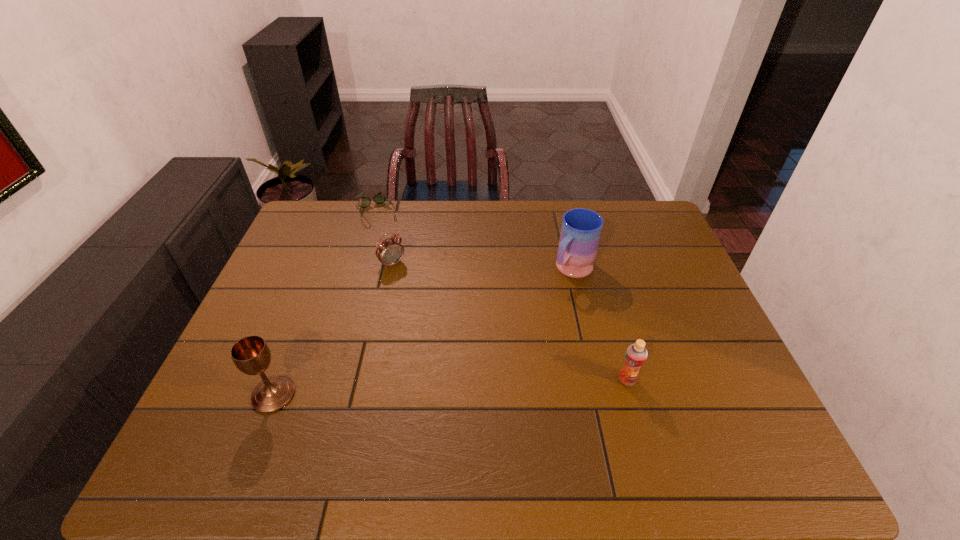
What are the coordinates of `chalice` in the screenshot? It's located at (251, 355).

At what (x,y) coordinates should I click in order to perform the action: click on orange juice. Please return your answer as a coordinate pair (x, y). The image size is (960, 540). Looking at the image, I should click on (636, 354).

This screenshot has height=540, width=960. What are the coordinates of `the fourth tallest object` in the screenshot? It's located at (389, 252).

The image size is (960, 540). I want to click on spectacles, so click(x=379, y=198).

Where is `the shortest object`? Image resolution: width=960 pixels, height=540 pixels. the shortest object is located at coordinates (379, 198).

Image resolution: width=960 pixels, height=540 pixels. Identify the location of mug. (581, 229).

In order to click on free space located on the left of the chalice in this screenshot , I will do `click(215, 395)`.

What are the coordinates of `vacant space located 0.150m on the left of the third shortest object` in the screenshot? It's located at (556, 380).

Identify the location of vacant space situated 0.380m on the face of the alarm clock. (470, 349).

I want to click on vacant point located on the face of the alarm clock, so click(x=432, y=306).